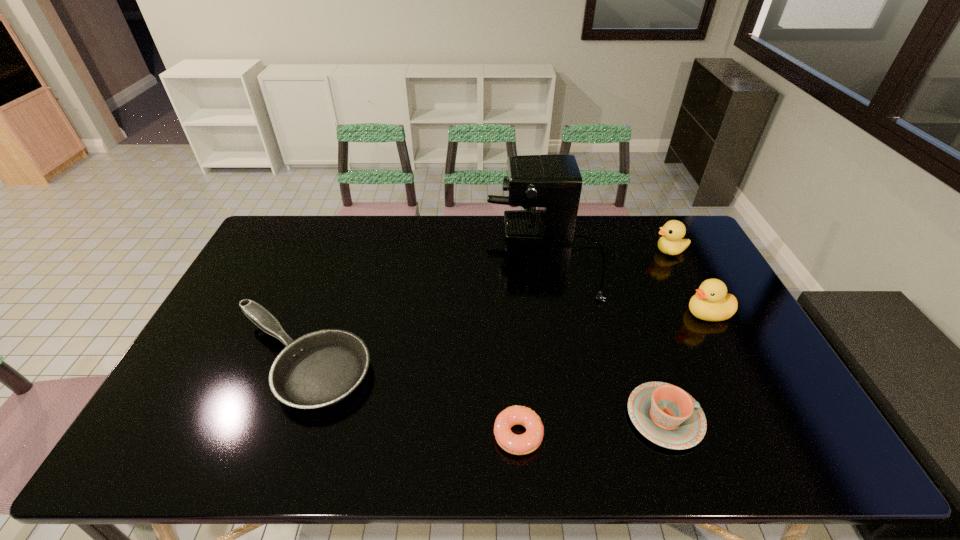
You are a GUI agent. You are given a task and a screenshot of the screen. Output one action in this format:
    pyautogui.click(x=<x>, y=<y>)
    Task: Click on the tallest object
    
    Given the screenshot: What is the action you would take?
    pyautogui.click(x=552, y=182)

Identify the location of the nearer duck. (711, 302).

The height and width of the screenshot is (540, 960). I want to click on the farther duck, so click(x=671, y=243).

Where is `frying pan`? The width and height of the screenshot is (960, 540). frying pan is located at coordinates (317, 370).

You are a GUI agent. You are given a task and a screenshot of the screen. Output one action in this format:
    pyautogui.click(x=<x>, y=<y>)
    Task: Click on the chinaware
    
    Given the screenshot: What is the action you would take?
    pyautogui.click(x=668, y=416)

This screenshot has height=540, width=960. In order to click on doughnut in this screenshot , I will do `click(525, 443)`.

Locate an element on the screen. The height and width of the screenshot is (540, 960). vacant space located 0.060m on the front-facing side of the tallest object is located at coordinates (470, 254).

Find the location of a particular element. The image size is (960, 540). free point located 0.200m on the front-facing side of the tallest object is located at coordinates (430, 254).

I want to click on vacant area situated 0.340m on the front-facing side of the tallest object, so click(391, 254).

Locate an element on the screen. vacant space situated at the beak of the nearer duck is located at coordinates (668, 313).